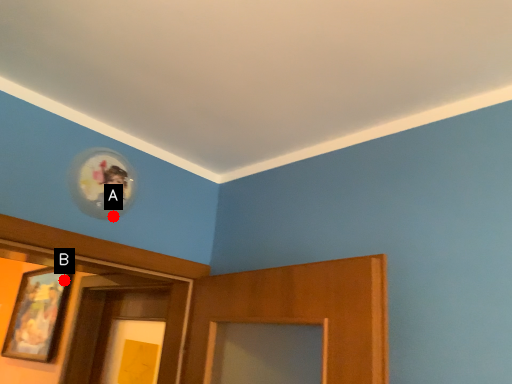
Question: Two points are circled on the image, labeled by A and B beside each circle. Which point is closer to the camera?

Choices:
 (A) A is closer
 (B) B is closer

Answer: (A)